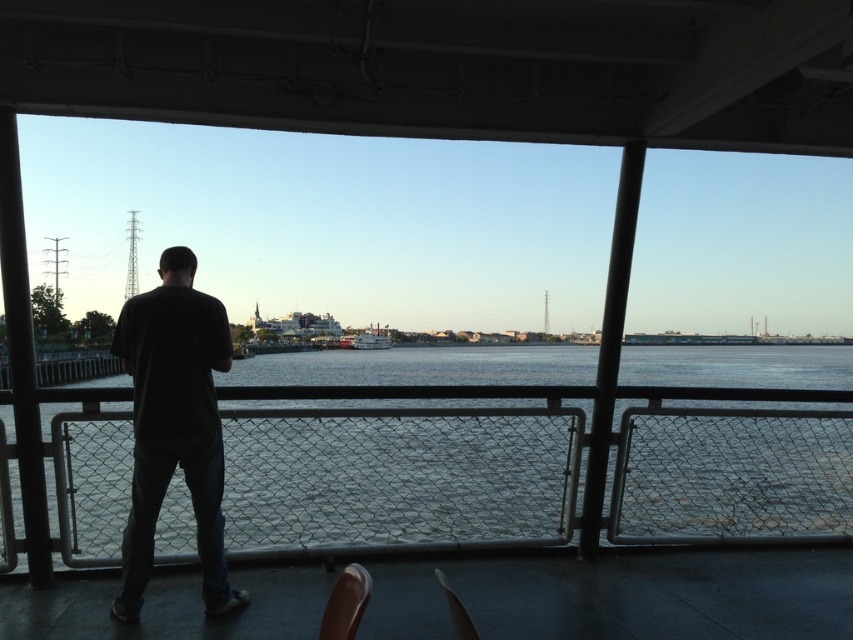
Question: Does dark matte shirt at center lie in front of brown leather chair at lower center?

Choices:
 (A) yes
 (B) no

Answer: (B)

Question: Which point is closer to the camera?

Choices:
 (A) white wooden boat at center
 (B) dark matte shirt at center

Answer: (B)

Question: Is clear water at center closer to camera compared to white wooden boat at center?

Choices:
 (A) yes
 (B) no

Answer: (A)

Question: Considering the real-world distances, which object is farthest from the white wooden boat at center?

Choices:
 (A) brown leather chair at lower center
 (B) matte plastic chair at lower center

Answer: (A)

Question: Which object is the farthest from the clear water at center?

Choices:
 (A) dark matte shirt at center
 (B) white wooden boat at center
 (C) matte plastic chair at lower center

Answer: (C)

Question: Observing the image, what is the correct spatial positioning of dark matte shirt at center in reference to brown leather chair at lower center?

Choices:
 (A) right
 (B) left

Answer: (B)